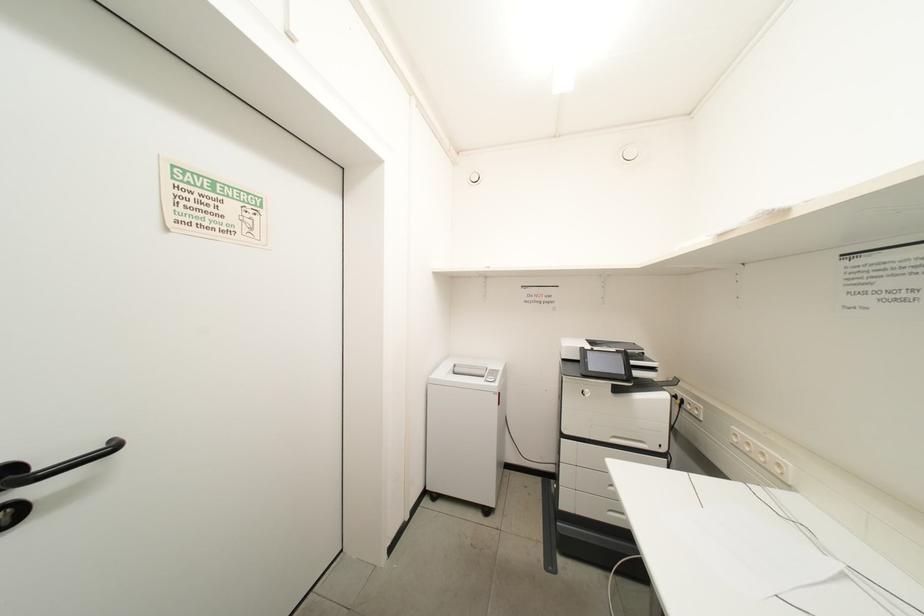
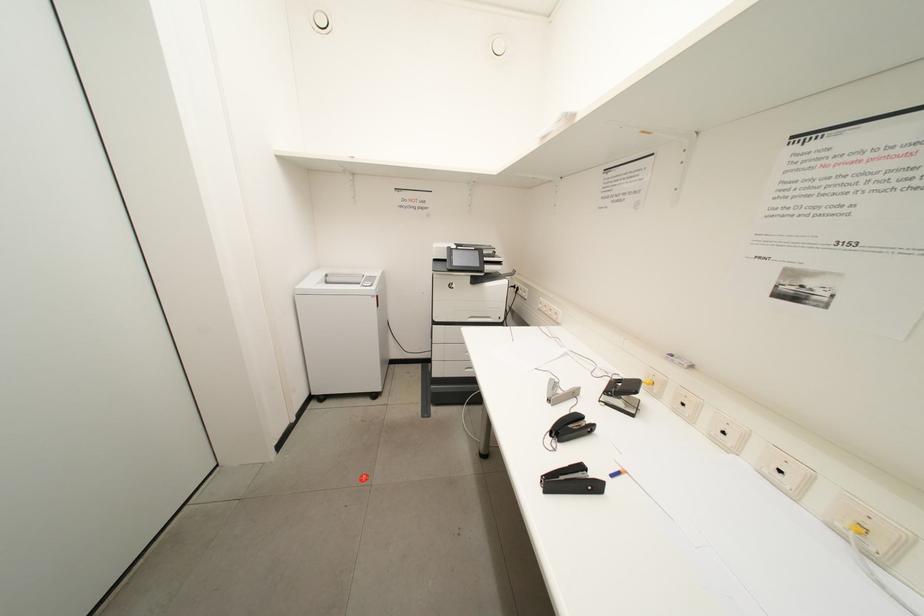
The first image is from the beginning of the video and the second image is from the end. How did the camera likely rotate when shooting the video?

The rotation direction of the camera is right-down.